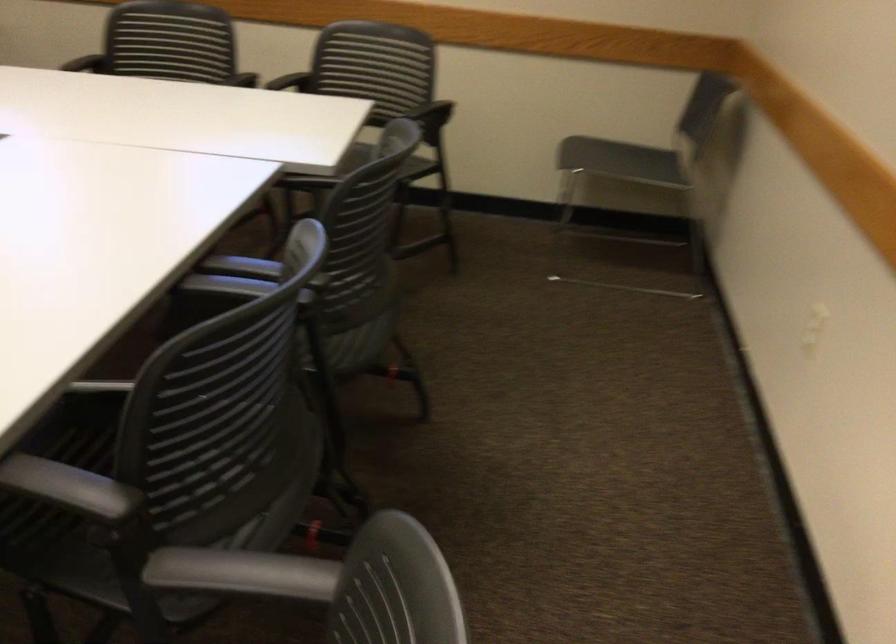
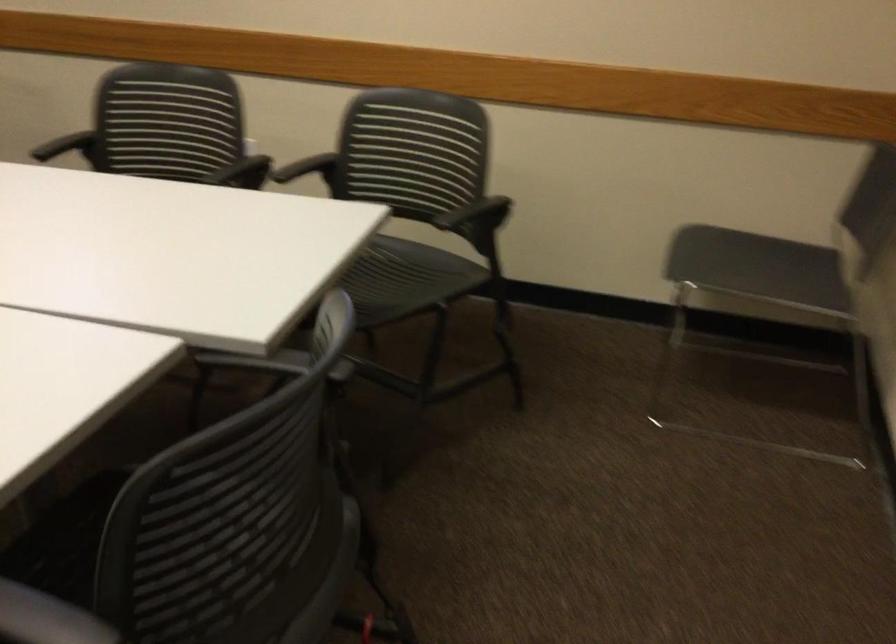
Question: Which direction would the cameraman need to move to produce the second image? Reply with the corresponding letter.

Choices:
 (A) Left
 (B) Right
 (C) Forward
 (D) Backward

Answer: (C)